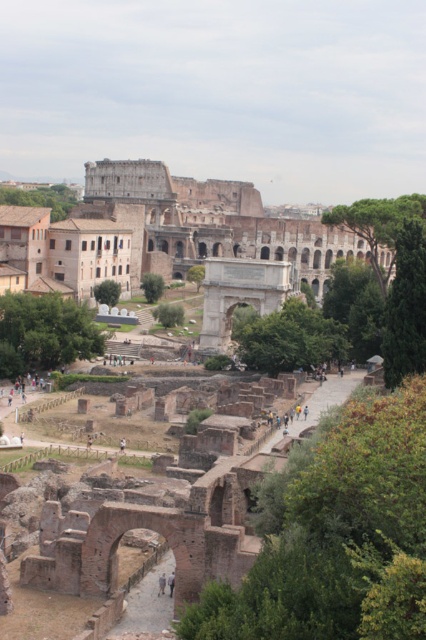
Between light brown leather shoes at center and light brown leather jacket at center, which one appears on the right side from the viewer's perspective?

light brown leather jacket at center

Does light brown leather shoes at center have a smaller size compared to light brown leather jacket at center?

No, light brown leather shoes at center is not smaller than light brown leather jacket at center.

Does point (161, 576) come in front of point (169, 588)?

No, (161, 576) is behind (169, 588).

Identify the location of light brown leather shoes at center. Image resolution: width=426 pixels, height=640 pixels. (161, 584).